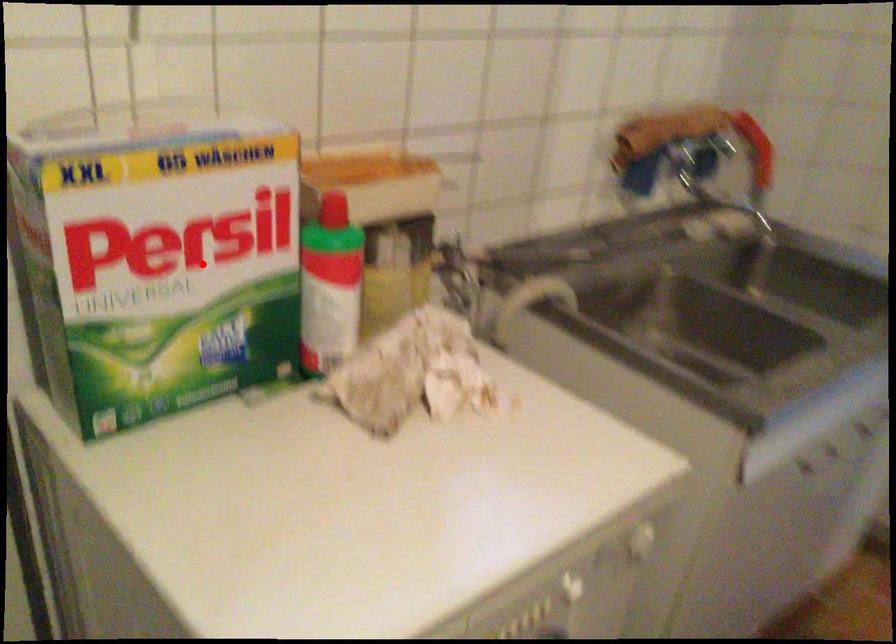
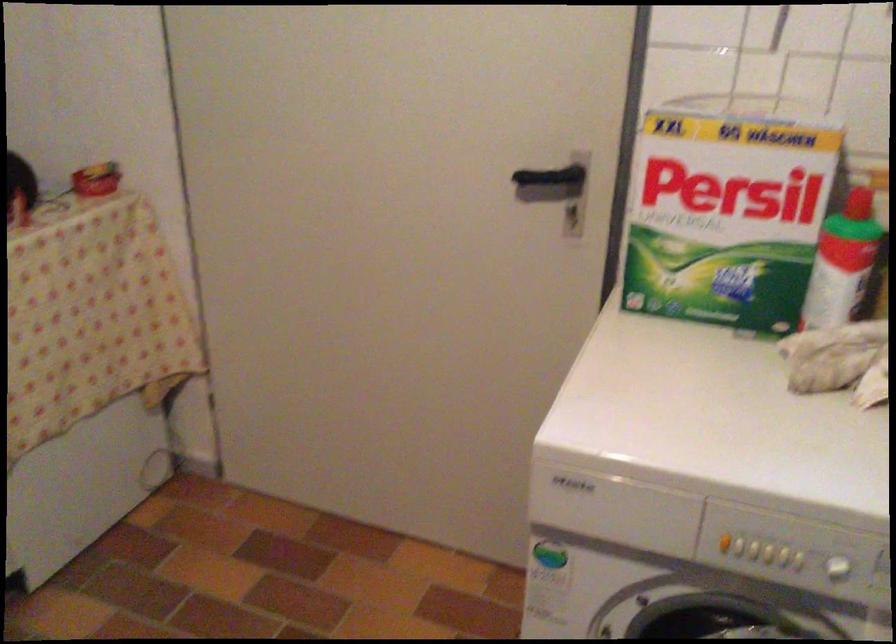
Question: I am providing you with two images of the same scene from different viewpoints. Given a red point in image1, look at the same physical point in image2. Is it:

Choices:
 (A) Closer to the viewpoint
 (B) Farther from the viewpoint

Answer: (B)